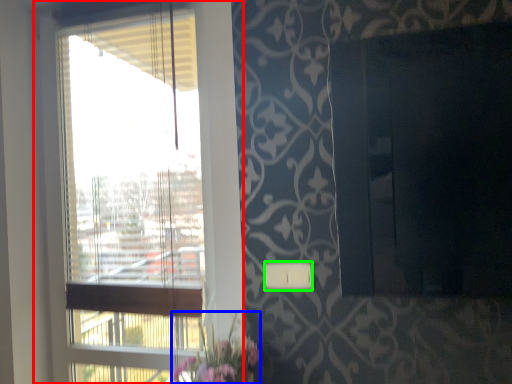
Question: Considering the real-world distances, which object is closest to window (highlighted by a red box)? floral arrangement (highlighted by a blue box) or light switch (highlighted by a green box).

Choices:
 (A) floral arrangement
 (B) light switch

Answer: (A)